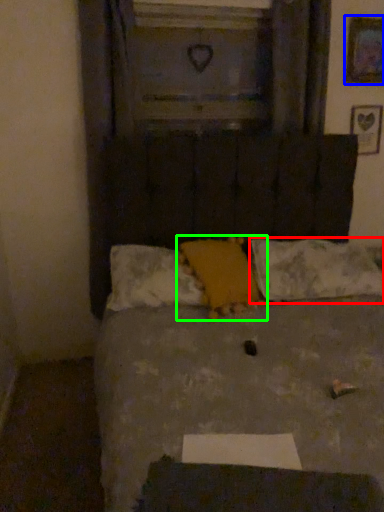
Question: Which object is positioned closest to pillow (highlighted by a red box)? Select from picture frame (highlighted by a blue box) and pillow (highlighted by a green box).

Choices:
 (A) picture frame
 (B) pillow

Answer: (B)